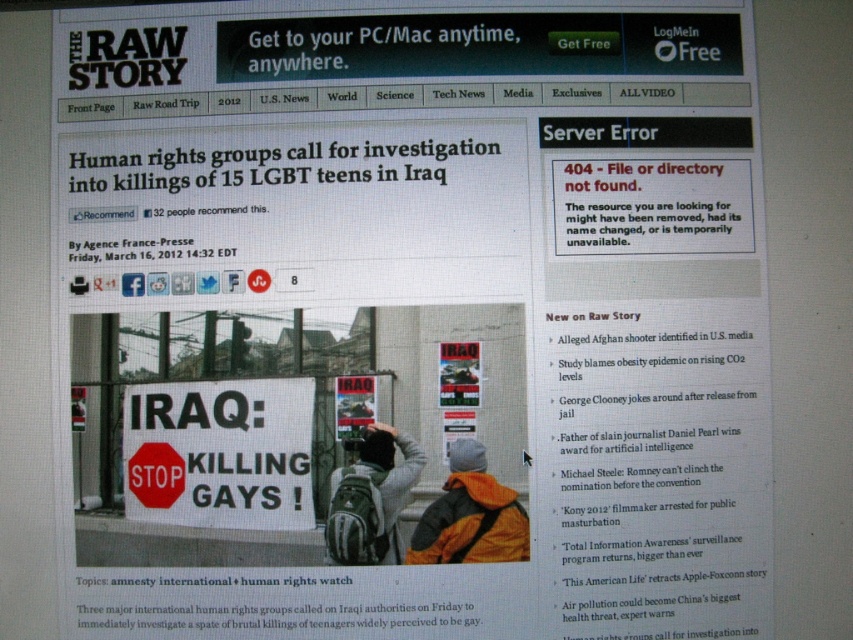
Question: Can you confirm if orange fabric jacket at center is thinner than gray backpack at center?

Choices:
 (A) yes
 (B) no

Answer: (B)

Question: Where is orange fabric jacket at center located in relation to red matte stop sign at center in the image?

Choices:
 (A) left
 (B) right

Answer: (B)

Question: Which object is the farthest from the red matte stop sign at center?

Choices:
 (A) gray backpack at center
 (B) orange fabric jacket at center

Answer: (B)

Question: Considering the real-world distances, which object is closest to the gray backpack at center?

Choices:
 (A) orange fabric jacket at center
 (B) red matte stop sign at center

Answer: (A)

Question: Among these objects, which one is nearest to the camera?

Choices:
 (A) orange fabric jacket at center
 (B) red matte stop sign at center
 (C) gray backpack at center

Answer: (A)

Question: Does orange fabric jacket at center have a larger size compared to red matte stop sign at center?

Choices:
 (A) no
 (B) yes

Answer: (B)